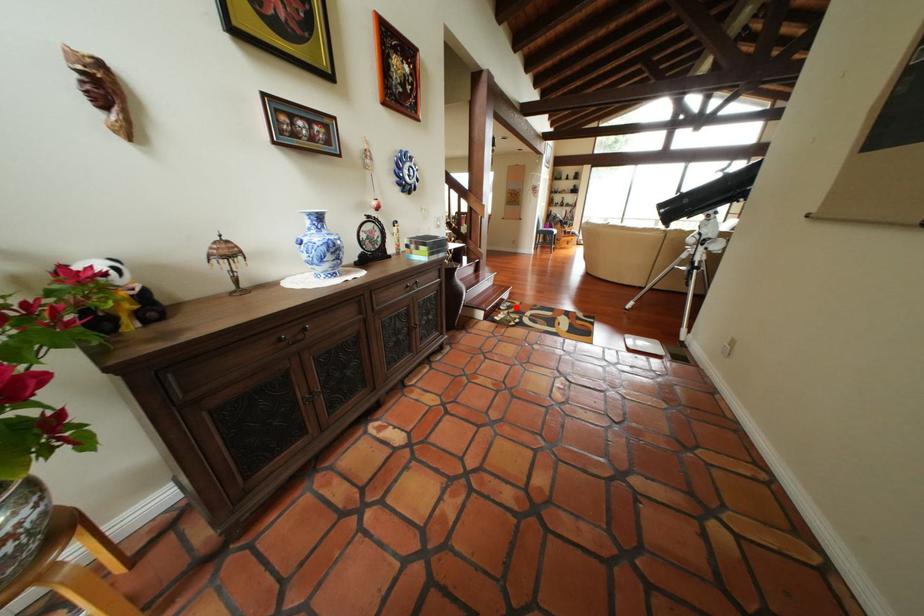
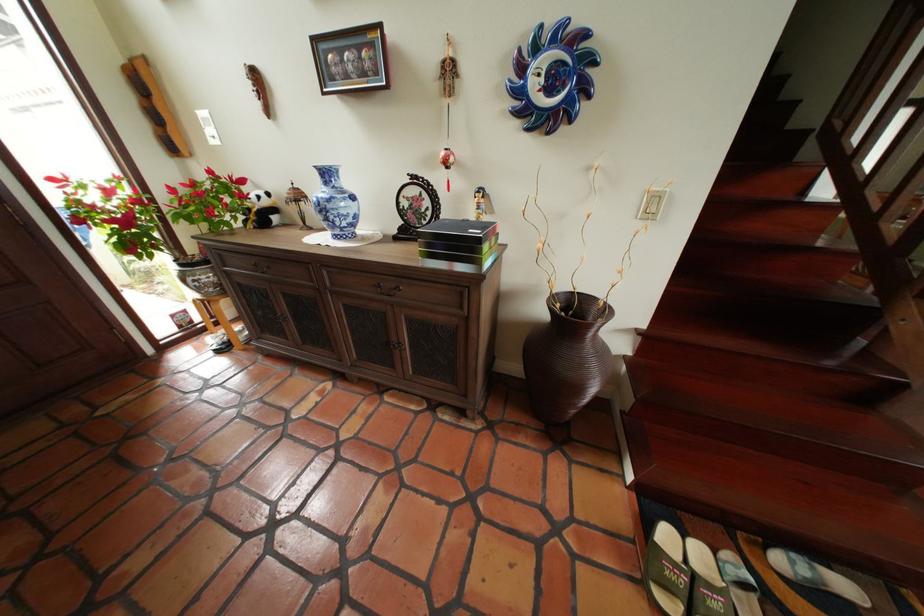
Question: I am providing you with two images of the same scene from different viewpoints. Given a red point in image1, look at the same physical point in image2. Is it:

Choices:
 (A) Closer to the viewpoint
 (B) Farther from the viewpoint

Answer: (A)